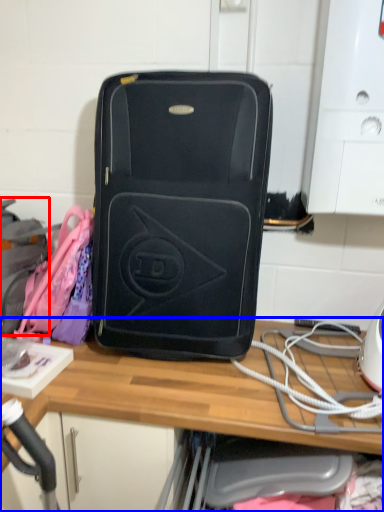
Question: Which object appears farthest to the camera in this image, luggage (highlighted by a red box) or desk (highlighted by a blue box)?

Choices:
 (A) luggage
 (B) desk

Answer: (A)